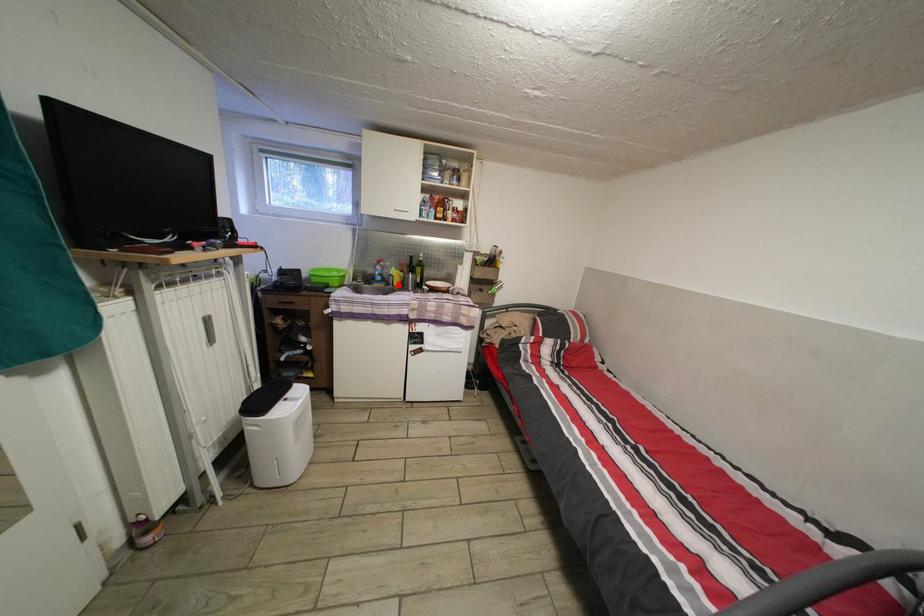
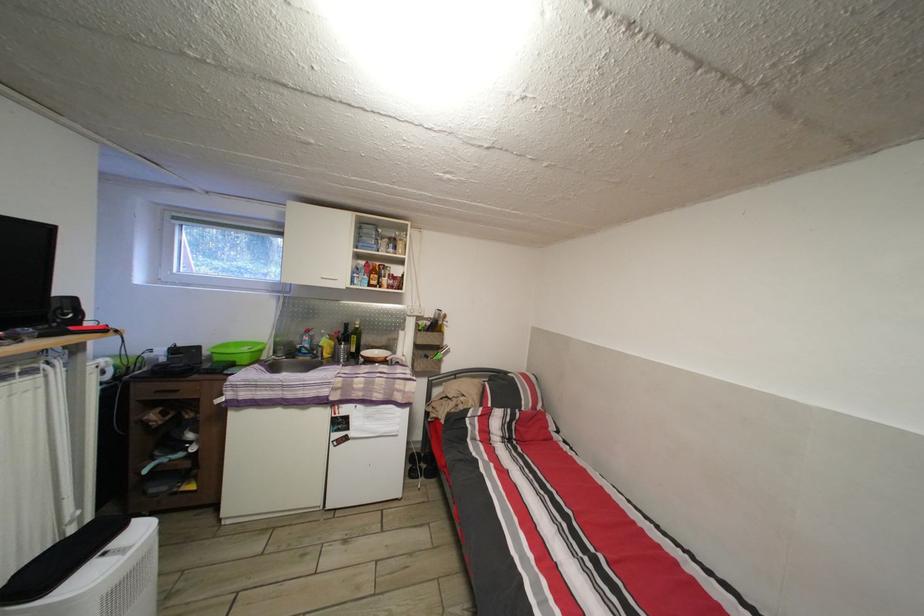
Find the pixel in the second image that matches the highlighted location in the first image.

(327, 355)